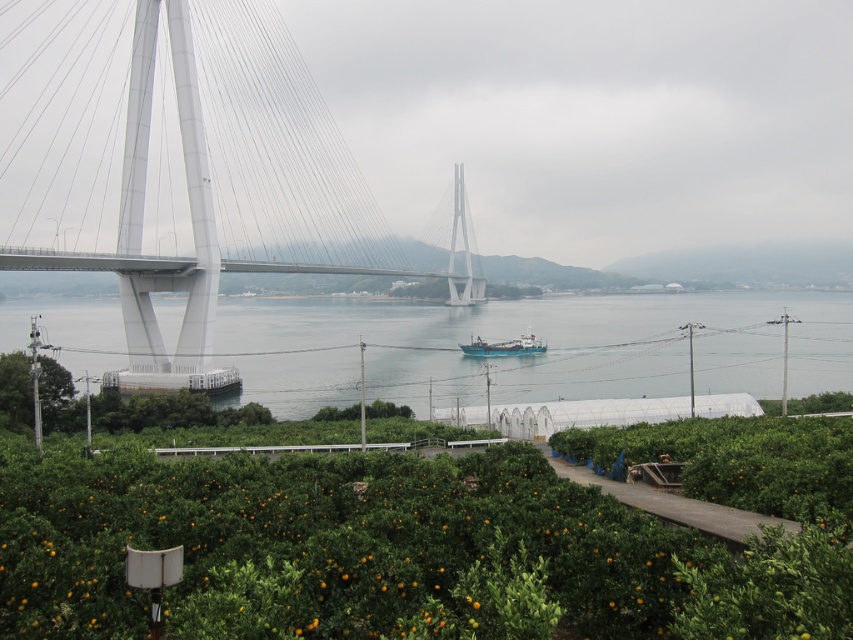
You are standing on the paved pathway in the orchard and want to cross to the other side of the water. The white metallic suspension bridge at left and the clear water at center are in your view. Which one can you physically walk across?

The white metallic suspension bridge at left is above clear water at center, so you can walk across the white metallic suspension bridge at left but not the clear water at center.

You are standing on the paved pathway in the orchard and want to take a photo of the white metallic suspension bridge at left and the clear water at center. Which object should you focus on first to ensure it appears larger in your photo?

You should focus on the white metallic suspension bridge at left first because it is closer to you than the clear water at center, so it will appear larger in the photo.

You are a photographer trying to capture the blue matte boat at center in your shot. However, you notice the white metallic suspension bridge at left is blocking the view. Can you adjust your position to frame the boat without the bridge obstructing it?

The white metallic suspension bridge at left is in front of the blue matte boat at center, so moving your position to the right side of the bridge would allow you to frame the boat without the bridge blocking it.